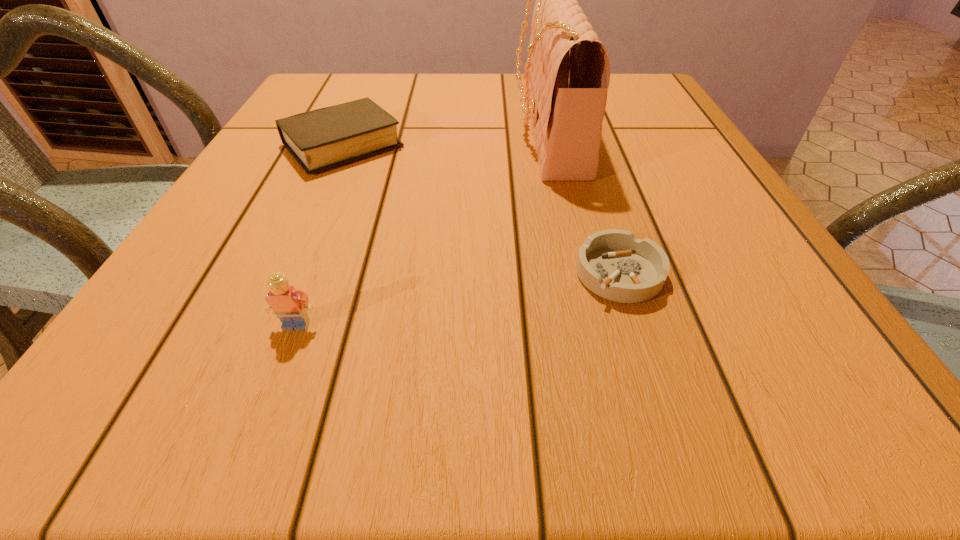
Identify the location of empty location between the Lego and the tallest object. (421, 228).

Locate an element on the screen. This screenshot has height=540, width=960. vacant point located between the second tallest object and the handbag is located at coordinates (421, 228).

Where is `free area in between the Lego and the third tallest object`? free area in between the Lego and the third tallest object is located at coordinates (320, 235).

In order to click on free area in between the second nearest object and the second tallest object in this screenshot , I will do `click(458, 299)`.

This screenshot has height=540, width=960. I want to click on vacant area that lies between the third farthest object and the third tallest object, so click(x=481, y=210).

You are a GUI agent. You are given a task and a screenshot of the screen. Output one action in this format:
    pyautogui.click(x=<x>, y=<y>)
    Task: Click on the vacant space in between the third farthest object and the second tallest object
    The image size is (960, 540).
    Given the screenshot: What is the action you would take?
    pyautogui.click(x=458, y=299)

The width and height of the screenshot is (960, 540). Find the location of `free space between the third shortest object and the handbag`. free space between the third shortest object and the handbag is located at coordinates (421, 228).

Find the location of `vacant region between the third tallest object and the handbag`. vacant region between the third tallest object and the handbag is located at coordinates (445, 138).

Identify the location of vacant area that lies between the tallest object and the shortest object. The height and width of the screenshot is (540, 960). (583, 202).

Locate which object ranks in proximity to the ashtray. Please provide its 2D coordinates. Your answer should be formatted as a tuple, i.e. [(x, y)], where the tuple contains the x and y coordinates of a point satisfying the conditions above.

[(567, 73)]